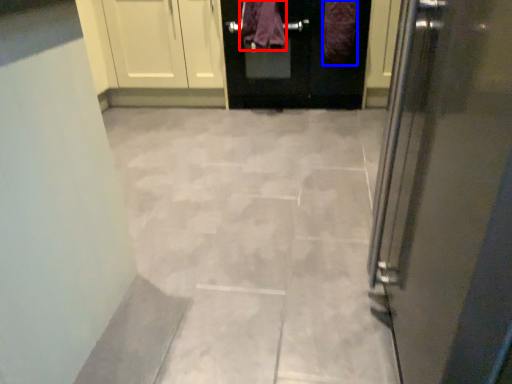
Question: Among these objects, which one is nearest to the camera, blanket (highlighted by a red box) or blanket (highlighted by a blue box)?

Choices:
 (A) blanket
 (B) blanket

Answer: (B)